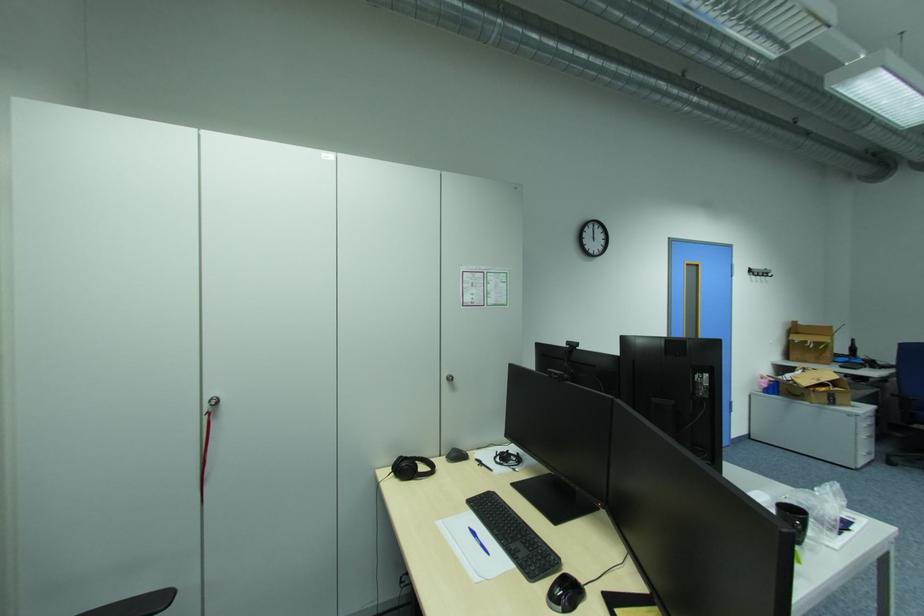
Find the location of a particular element. The height and width of the screenshot is (616, 924). black computer mouse is located at coordinates (565, 593).